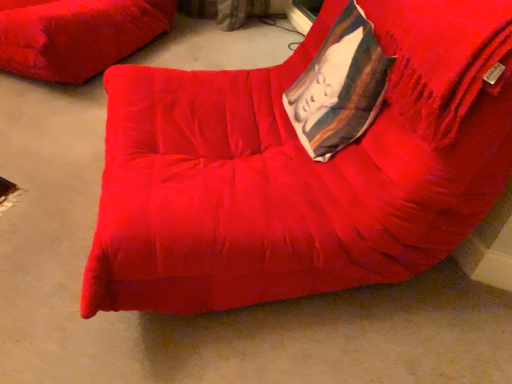
Question: Considering the relative sizes of velvet red cushion at upper left, which appears as the 2th furniture when viewed from the front, and velvet red bean bag chair at center, the 2th furniture in the back-to-front sequence, in the image provided, is velvet red cushion at upper left, which appears as the 2th furniture when viewed from the front, bigger than velvet red bean bag chair at center, the 2th furniture in the back-to-front sequence,?

Choices:
 (A) yes
 (B) no

Answer: (B)

Question: Is velvet red cushion at upper left, which appears as the 2th furniture when viewed from the front, aimed at velvet red bean bag chair at center, the 2th furniture in the back-to-front sequence?

Choices:
 (A) no
 (B) yes

Answer: (A)

Question: Is velvet red cushion at upper left, arranged as the 1th furniture when viewed from the back, taller than velvet red bean bag chair at center, which is counted as the 1th furniture, starting from the right?

Choices:
 (A) no
 (B) yes

Answer: (A)

Question: From a real-world perspective, is velvet red cushion at upper left, which appears as the first furniture when viewed from the left, on velvet red bean bag chair at center, marked as the first furniture in a front-to-back arrangement?

Choices:
 (A) no
 (B) yes

Answer: (A)

Question: Could velvet red bean bag chair at center, the 2th furniture in the back-to-front sequence, be considered to be inside velvet red cushion at upper left, arranged as the 1th furniture when viewed from the back?

Choices:
 (A) yes
 (B) no

Answer: (B)

Question: In the image, is velvet-like white pillow at upper right positioned in front of or behind velvet red cushion at upper left, arranged as the 1th furniture when viewed from the back?

Choices:
 (A) behind
 (B) front

Answer: (B)

Question: From a real-world perspective, is velvet-like white pillow at upper right positioned above or below velvet red cushion at upper left, which is counted as the 2th furniture, starting from the right?

Choices:
 (A) above
 (B) below

Answer: (A)

Question: Is velvet-like white pillow at upper right situated inside velvet red cushion at upper left, which appears as the 2th furniture when viewed from the front, or outside?

Choices:
 (A) inside
 (B) outside

Answer: (B)

Question: In terms of height, does velvet-like white pillow at upper right look taller or shorter compared to velvet red cushion at upper left, which appears as the 2th furniture when viewed from the front?

Choices:
 (A) short
 (B) tall

Answer: (A)

Question: Is velvet red bean bag chair at center, which is counted as the 1th furniture, starting from the right, in front of or behind velvet red cushion at upper left, which appears as the first furniture when viewed from the left, in the image?

Choices:
 (A) front
 (B) behind

Answer: (A)

Question: From the image's perspective, relative to velvet red cushion at upper left, arranged as the 1th furniture when viewed from the back, is velvet red bean bag chair at center, which is counted as the 1th furniture, starting from the right, above or below?

Choices:
 (A) below
 (B) above

Answer: (A)

Question: Based on their sizes in the image, would you say velvet red bean bag chair at center, which is counted as the 1th furniture, starting from the right, is bigger or smaller than velvet red cushion at upper left, which is counted as the 2th furniture, starting from the right?

Choices:
 (A) big
 (B) small

Answer: (A)

Question: From a real-world perspective, is velvet red bean bag chair at center, the 2th furniture in the back-to-front sequence, above or below velvet red cushion at upper left, arranged as the 1th furniture when viewed from the back?

Choices:
 (A) above
 (B) below

Answer: (A)

Question: From a real-world perspective, is velvet-like white pillow at upper right above or below velvet red bean bag chair at center, which is counted as the 1th furniture, starting from the right?

Choices:
 (A) above
 (B) below

Answer: (A)

Question: Would you say velvet-like white pillow at upper right is to the left or to the right of velvet red bean bag chair at center, the 2th furniture in the back-to-front sequence, in the picture?

Choices:
 (A) right
 (B) left

Answer: (A)